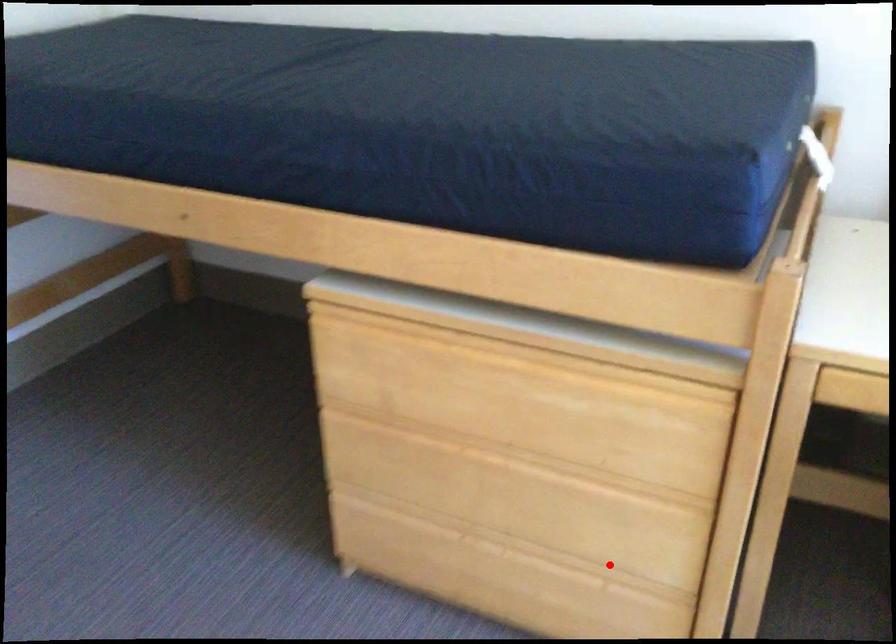
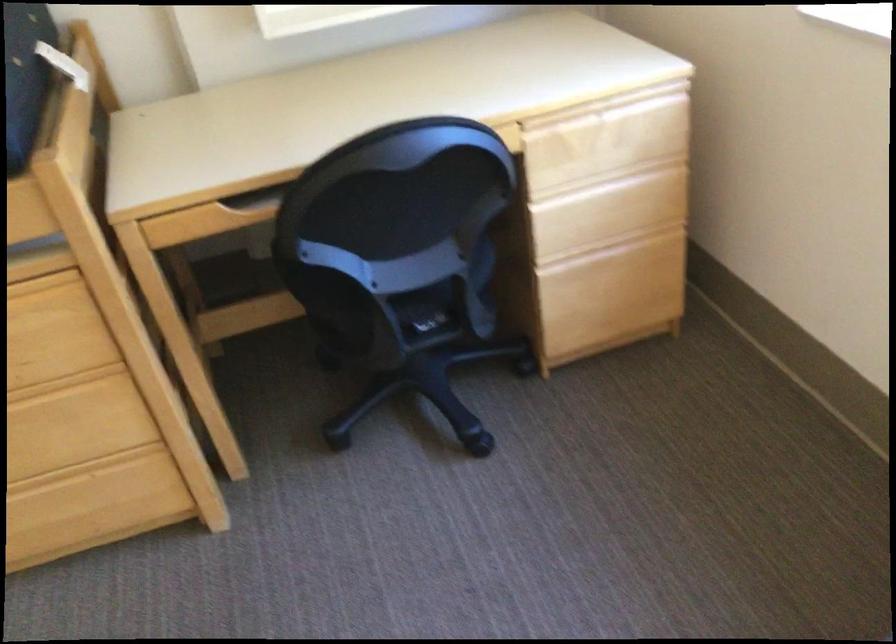
Question: I am providing you with two images of the same scene from different viewpoints. Given a red point in image1, look at the same physical point in image2. Is it:

Choices:
 (A) Closer to the viewpoint
 (B) Farther from the viewpoint

Answer: (B)